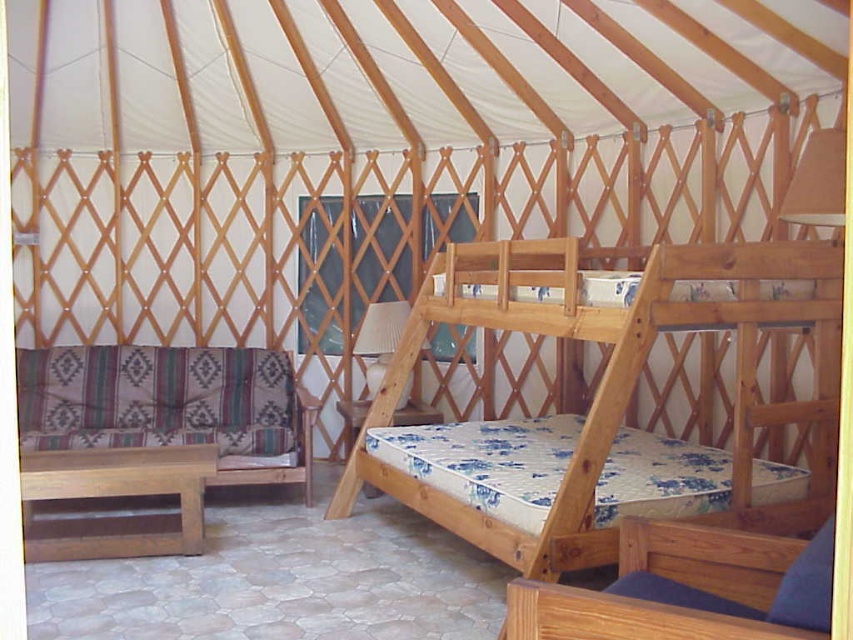
Question: Is natural wood bunk bed at center wider than striped fabric couch at lower left?

Choices:
 (A) yes
 (B) no

Answer: (A)

Question: Observing the image, what is the correct spatial positioning of natural wood bunk bed at center in reference to striped fabric couch at lower left?

Choices:
 (A) right
 (B) left

Answer: (A)

Question: Is natural wood bunk bed at center positioned behind striped fabric couch at lower left?

Choices:
 (A) no
 (B) yes

Answer: (A)

Question: Which point appears farthest from the camera in this image?

Choices:
 (A) (614, 355)
 (B) (252, 353)

Answer: (B)

Question: Which of the following is the farthest from the observer?

Choices:
 (A) (332, 508)
 (B) (167, 442)

Answer: (A)